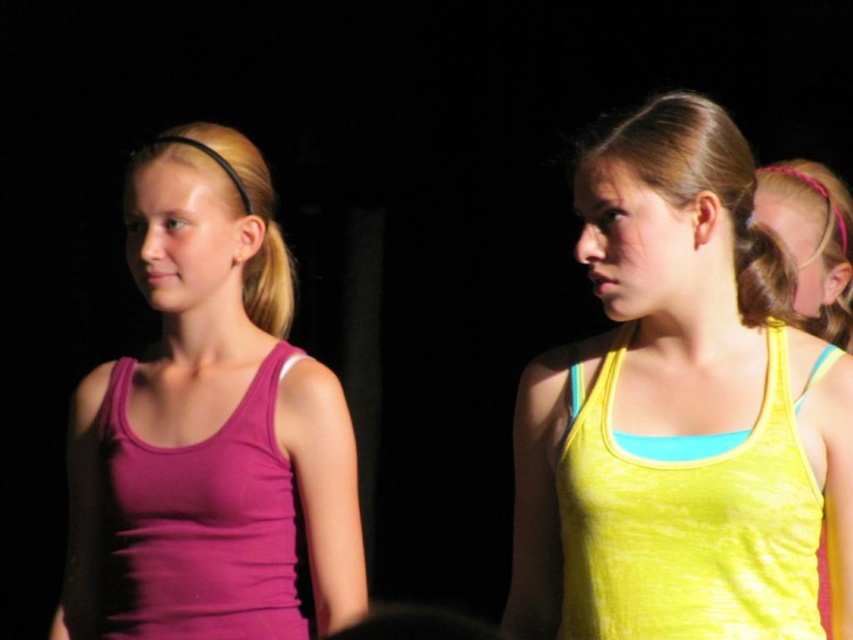
What is located at the coordinates point [688,522]?

The yellow fabric vest at right is located at point [688,522].

You are a fashion designer observing the two girls in the image. You need to determine which garment is narrower between the yellow fabric vest at right and the matte purple tank top at left. Which one is narrower?

The yellow fabric vest at right is narrower than the matte purple tank top at left, as it has a lesser width according to the description.

Based on the scene description, can you determine which object is taller between the yellow matte tank top at center and the pink hairband at upper right?

The yellow matte tank top at center is taller than the pink hairband at upper right according to the description.